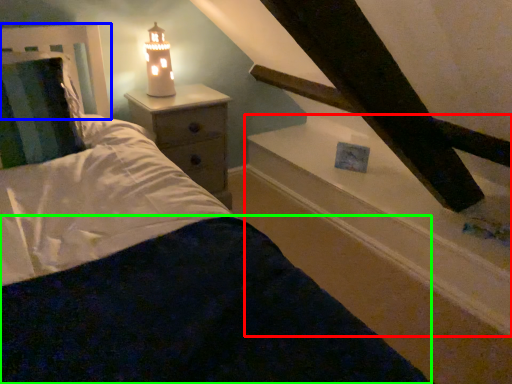
Question: Estimate the real-world distances between objects in this image. Which object is closer to window sill (highlighted by a red box), headboard (highlighted by a blue box) or bedding (highlighted by a green box)?

Choices:
 (A) headboard
 (B) bedding

Answer: (B)